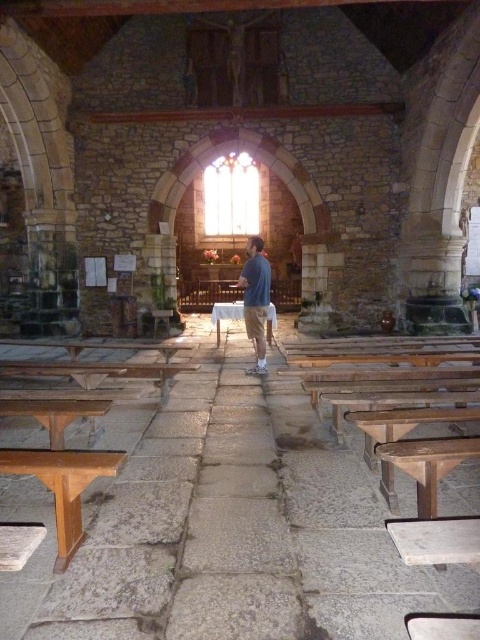
You are standing in the church and see both the blue cotton shirt at center and the wooden bench at center. Which object is positioned to the right side of the other?

The blue cotton shirt at center is to the right of the wooden bench at center.

You are standing in the church and want to sit down. Which object, the wooden bench at lower left or the blue cotton shirt at center, is closer to you and more accessible?

The wooden bench at lower left is closer to the viewer than the blue cotton shirt at center, so it is more accessible.

You are standing at the entrance of the church and want to sit down. There are two wooden benches available. Which one is closer to the entrance? The wooden bench at lower left or the wooden bench at center?

The wooden bench at lower left is closer to the entrance because it is located below the wooden bench at center, meaning it is positioned lower in the frame and thus nearer to the entrance area.